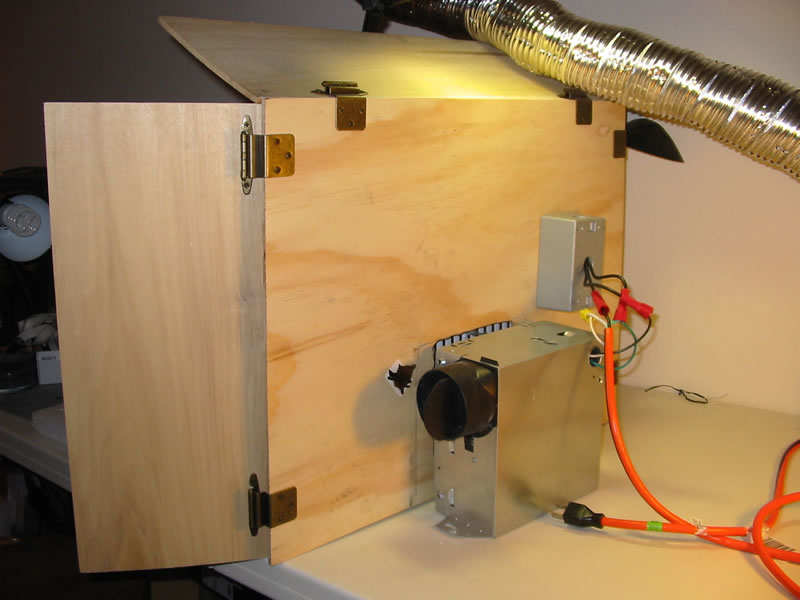
Locate an element on the screen. wooden panels at 90 degree to eachother is located at coordinates (169, 181), (224, 54).